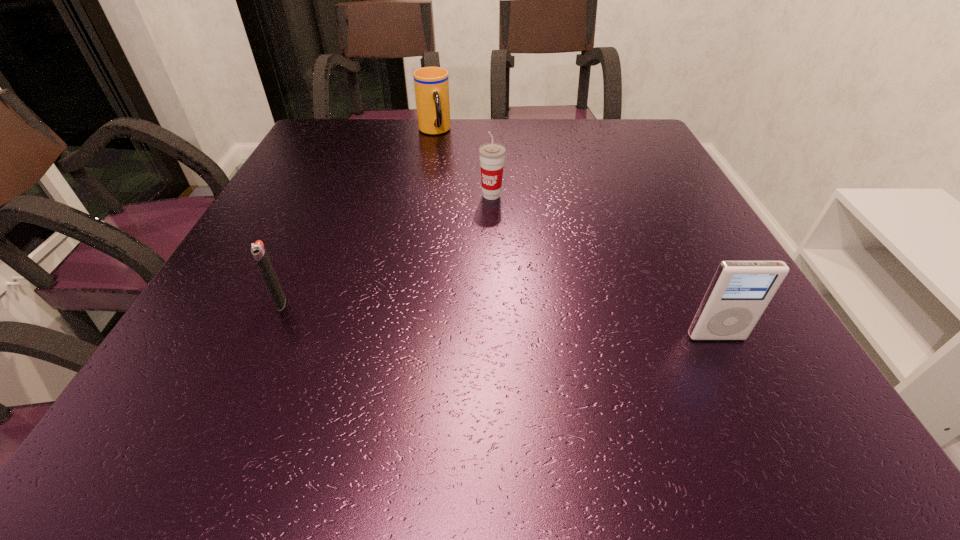
The width and height of the screenshot is (960, 540). I want to click on igniter, so click(x=258, y=250).

What are the coordinates of `the leftmost object` in the screenshot? It's located at (258, 250).

Image resolution: width=960 pixels, height=540 pixels. I want to click on the nearest object, so click(x=740, y=291).

Where is `iPod`? iPod is located at coordinates (740, 291).

Identify the location of the farthest object. The height and width of the screenshot is (540, 960). (431, 84).

Locate an element on the screen. The image size is (960, 540). the second object from left to right is located at coordinates click(431, 84).

The height and width of the screenshot is (540, 960). Identify the location of the second farthest object. (492, 155).

The height and width of the screenshot is (540, 960). I want to click on the second object from right to left, so click(x=492, y=155).

The height and width of the screenshot is (540, 960). I want to click on free space located on the back of the shortest object, so click(x=328, y=198).

Locate an element on the screen. free space located 0.200m on the side of the second object from left to right with the handle is located at coordinates (455, 177).